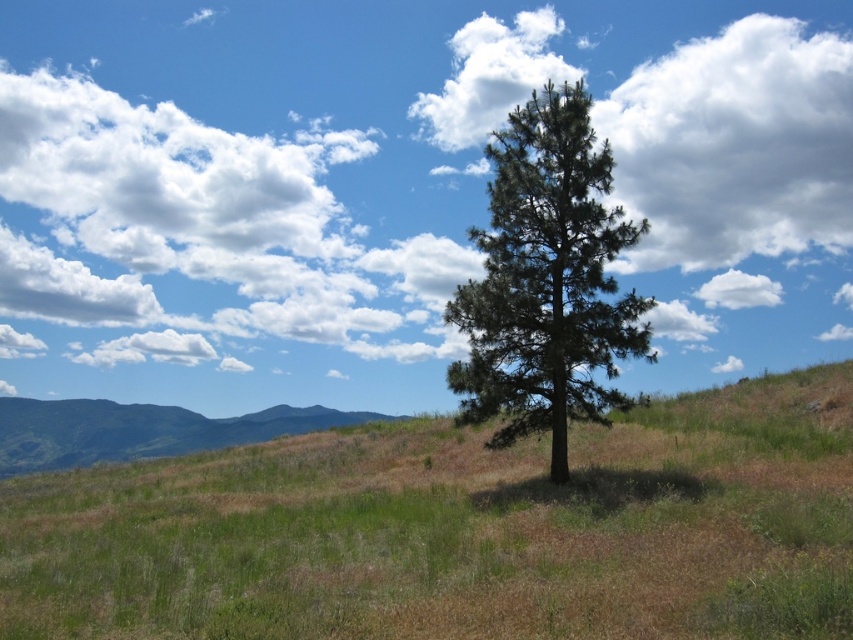
Question: Estimate the real-world distances between objects in this image. Which object is closer to the green grassy hillside at lower left?

Choices:
 (A) green grass at center
 (B) green needle-like tree at center
 (C) white fluffy cloud at upper right
 (D) white fluffy cloud at upper center

Answer: (D)

Question: Can you confirm if green grass at center is positioned below white fluffy cloud at upper center?

Choices:
 (A) no
 (B) yes

Answer: (B)

Question: Among these objects, which one is nearest to the camera?

Choices:
 (A) green needle-like tree at center
 (B) green grass at center
 (C) green grassy hillside at lower left

Answer: (B)

Question: Can you confirm if white fluffy cloud at upper right is wider than white fluffy cloud at upper center?

Choices:
 (A) yes
 (B) no

Answer: (A)

Question: Can you confirm if green grass at center is wider than white fluffy cloud at upper right?

Choices:
 (A) no
 (B) yes

Answer: (B)

Question: Considering the real-world distances, which object is farthest from the green grass at center?

Choices:
 (A) white fluffy cloud at upper center
 (B) white fluffy cloud at upper right
 (C) green grassy hillside at lower left

Answer: (A)